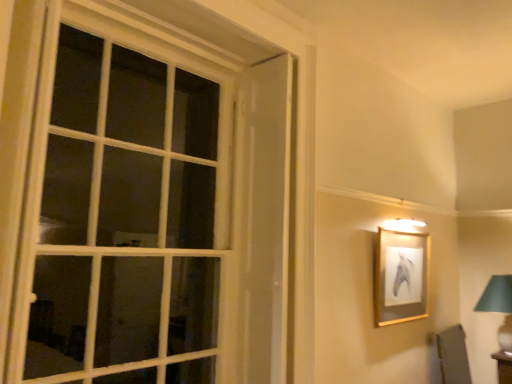
You are a GUI agent. You are given a task and a screenshot of the screen. Output one action in this format:
    pyautogui.click(x=<x>, y=<y>)
    Task: Click on the green fabric lampshade at right
    The width and height of the screenshot is (512, 384).
    Given the screenshot: What is the action you would take?
    pyautogui.click(x=499, y=308)

Where is `gold/glossy picture frame at upper right`? The width and height of the screenshot is (512, 384). gold/glossy picture frame at upper right is located at coordinates (400, 276).

Can you confirm if white glass window at left is positioned to the left of green fabric lampshade at right?

Yes, white glass window at left is to the left of green fabric lampshade at right.

Is white glass window at left looking in the opposite direction of green fabric lampshade at right?

No, white glass window at left is not facing the opposite direction of green fabric lampshade at right.

Looking at their sizes, would you say white glass window at left is wider or thinner than green fabric lampshade at right?

white glass window at left is thinner than green fabric lampshade at right.

Does point (504, 339) lie behind point (28, 172)?

Yes.

Relative to white glass window at left, is green fabric lampshade at right in front or behind?

Visually, green fabric lampshade at right is located behind white glass window at left.

Does green fabric lampshade at right have a greater width compared to white glass window at left?

Yes.

Considering the positions of point (53, 43) and point (395, 293), is point (53, 43) closer or farther from the camera than point (395, 293)?

Point (53, 43) is closer to the camera than point (395, 293).

Does white glass window at left come behind gold/glossy picture frame at upper right?

No, white glass window at left is closer to the viewer.

Is white glass window at left situated inside gold/glossy picture frame at upper right or outside?

white glass window at left is located beyond the bounds of gold/glossy picture frame at upper right.

Is point (386, 320) less distant than point (504, 347)?

Yes, point (386, 320) is closer to viewer.

Who is taller, gold/glossy picture frame at upper right or green fabric lampshade at right?

Standing taller between the two is gold/glossy picture frame at upper right.

Is gold/glossy picture frame at upper right inside or outside of green fabric lampshade at right?

gold/glossy picture frame at upper right cannot be found inside green fabric lampshade at right.

Is the depth of gold/glossy picture frame at upper right greater than that of white glass window at left?

Yes, it is.

From the image's perspective, which is above, gold/glossy picture frame at upper right or white glass window at left?

white glass window at left is shown above in the image.

From a real-world perspective, which object stands above the other?

white glass window at left is physically above.

Does gold/glossy picture frame at upper right turn towards white glass window at left?

No, gold/glossy picture frame at upper right is not facing towards white glass window at left.

Can you confirm if green fabric lampshade at right is positioned to the left of gold/glossy picture frame at upper right?

No.

Considering the sizes of objects green fabric lampshade at right and gold/glossy picture frame at upper right in the image provided, who is taller, green fabric lampshade at right or gold/glossy picture frame at upper right?

gold/glossy picture frame at upper right.

Between point (506, 307) and point (384, 274), which one is positioned behind?

Point (506, 307)

The width and height of the screenshot is (512, 384). I want to click on window on the left side of green fabric lampshade at right, so click(x=143, y=197).

The image size is (512, 384). I want to click on window that is above the green fabric lampshade at right (from the image's perspective), so click(x=143, y=197).

Based on their spatial positions, is green fabric lampshade at right or white glass window at left closer to gold/glossy picture frame at upper right?

Among the two, green fabric lampshade at right is located nearer to gold/glossy picture frame at upper right.

When comparing their distances from green fabric lampshade at right, does white glass window at left or gold/glossy picture frame at upper right seem further?

The object further to green fabric lampshade at right is white glass window at left.

Estimate the real-world distances between objects in this image. Which object is closer to green fabric lampshade at right, gold/glossy picture frame at upper right or white glass window at left?

gold/glossy picture frame at upper right is positioned closer to the anchor green fabric lampshade at right.

Looking at the image, which one is located further to gold/glossy picture frame at upper right, white glass window at left or green fabric lampshade at right?

white glass window at left.

Which object lies further to the anchor point white glass window at left, gold/glossy picture frame at upper right or green fabric lampshade at right?

green fabric lampshade at right lies further to white glass window at left than the other object.

From the image, which object appears to be nearer to white glass window at left, green fabric lampshade at right or gold/glossy picture frame at upper right?

The object closer to white glass window at left is gold/glossy picture frame at upper right.

Locate an element on the screen. picture frame between white glass window at left and green fabric lampshade at right in the horizontal direction is located at coordinates (400, 276).